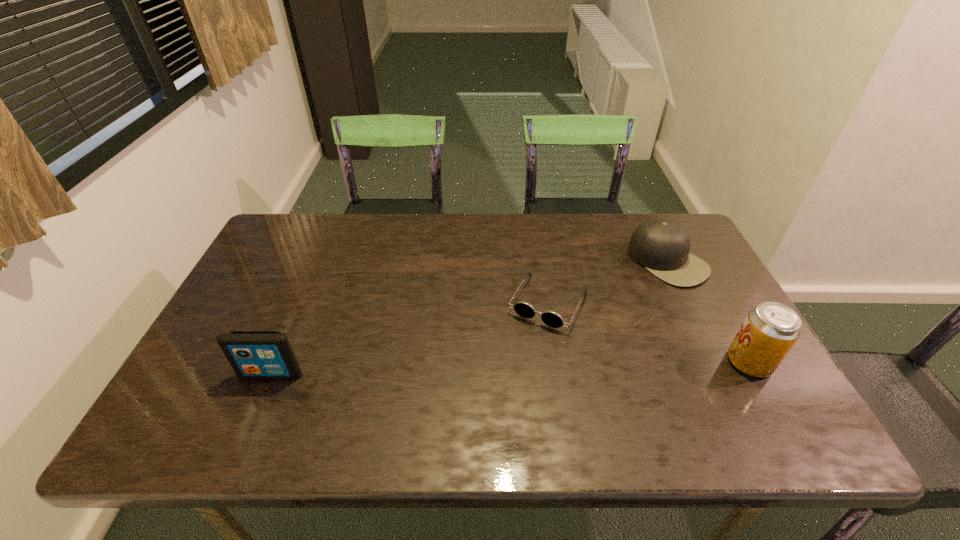
The width and height of the screenshot is (960, 540). In order to click on free space located on the front-facing side of the third object from right to left in this screenshot , I will do `click(526, 345)`.

You are a GUI agent. You are given a task and a screenshot of the screen. Output one action in this format:
    pyautogui.click(x=<x>, y=<y>)
    Task: Click on the free space located 0.310m on the brim of the second shortest object
    
    Given the screenshot: What is the action you would take?
    pyautogui.click(x=569, y=325)

Image resolution: width=960 pixels, height=540 pixels. In order to click on blank space located 0.390m on the brim of the second shortest object in this screenshot , I will do `click(546, 339)`.

Where is `vacant area situated on the brim of the second shortest object`? Image resolution: width=960 pixels, height=540 pixels. vacant area situated on the brim of the second shortest object is located at coordinates (546, 339).

At what (x,y) coordinates should I click in order to perform the action: click on object situated at the far edge. Please return your answer as a coordinate pair (x, y). The width and height of the screenshot is (960, 540). Looking at the image, I should click on (662, 246).

Image resolution: width=960 pixels, height=540 pixels. I want to click on iPod that is at the near edge, so click(252, 354).

Where is `pop (soda) present at the near edge`? The width and height of the screenshot is (960, 540). pop (soda) present at the near edge is located at coordinates (770, 330).

This screenshot has height=540, width=960. Identify the location of object that is at the left edge. (252, 354).

Find the location of `pop (soda) that is at the right edge`. pop (soda) that is at the right edge is located at coordinates (770, 330).

I want to click on cap at the right edge, so click(662, 246).